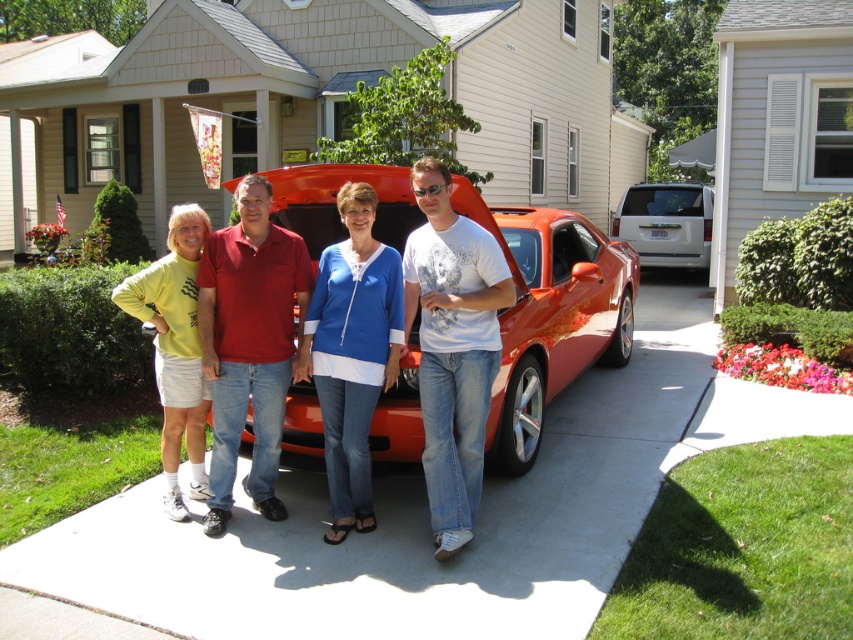
Question: Which point is closer to the camera?

Choices:
 (A) (701, 236)
 (B) (231, 364)
 (C) (193, 278)
 (D) (338, 444)

Answer: (B)

Question: From the image, what is the correct spatial relationship of shiny orange car at center in relation to white printed t-shirt at center?

Choices:
 (A) below
 (B) above

Answer: (B)

Question: Is red cotton polo shirt at center behind blue denim jeans at center?

Choices:
 (A) yes
 (B) no

Answer: (A)

Question: Which of these objects is positioned closest to the blue denim jeans at center?

Choices:
 (A) red cotton polo shirt at center
 (B) white printed t-shirt at center
 (C) shiny orange car at center

Answer: (B)

Question: Among these objects, which one is nearest to the camera?

Choices:
 (A) white glossy minivan at center
 (B) shiny orange car at center
 (C) white printed t-shirt at center
 (D) red cotton polo shirt at center

Answer: (C)

Question: Is blue denim jeans at center to the right of white glossy minivan at center from the viewer's perspective?

Choices:
 (A) yes
 (B) no

Answer: (B)